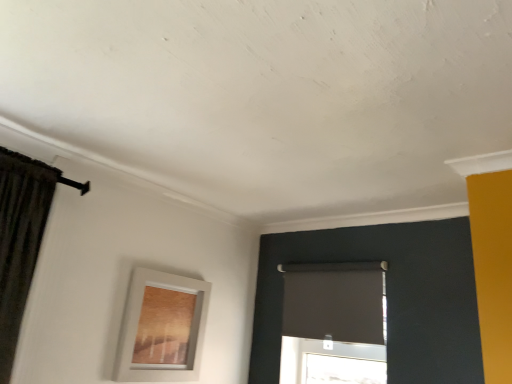
Question: Is the depth of white matte picture frame at lower left less than that of matte black roller shade at center?

Choices:
 (A) yes
 (B) no

Answer: (A)

Question: Is white matte picture frame at lower left positioned far away from matte black roller shade at center?

Choices:
 (A) yes
 (B) no

Answer: (B)

Question: Is white matte picture frame at lower left oriented towards matte black roller shade at center?

Choices:
 (A) no
 (B) yes

Answer: (A)

Question: From a real-world perspective, does white matte picture frame at lower left sit lower than matte black roller shade at center?

Choices:
 (A) yes
 (B) no

Answer: (A)

Question: Is white matte picture frame at lower left taller than matte black roller shade at center?

Choices:
 (A) no
 (B) yes

Answer: (B)

Question: Is white matte picture frame at lower left bigger than matte black roller shade at center?

Choices:
 (A) yes
 (B) no

Answer: (B)

Question: Does matte black roller shade at center have a lesser width compared to white matte picture frame at lower left?

Choices:
 (A) yes
 (B) no

Answer: (A)

Question: Is matte black roller shade at center bigger than white matte picture frame at lower left?

Choices:
 (A) no
 (B) yes

Answer: (B)

Question: Is the position of matte black roller shade at center less distant than that of white matte picture frame at lower left?

Choices:
 (A) yes
 (B) no

Answer: (B)

Question: Is matte black roller shade at center to the left of white matte picture frame at lower left from the viewer's perspective?

Choices:
 (A) no
 (B) yes

Answer: (A)

Question: From the image's perspective, would you say matte black roller shade at center is shown under white matte picture frame at lower left?

Choices:
 (A) no
 (B) yes

Answer: (A)

Question: Is matte black roller shade at center wider than white matte picture frame at lower left?

Choices:
 (A) no
 (B) yes

Answer: (A)

Question: Choose the correct answer: Is white matte picture frame at lower left inside matte black roller shade at center or outside it?

Choices:
 (A) inside
 (B) outside

Answer: (B)